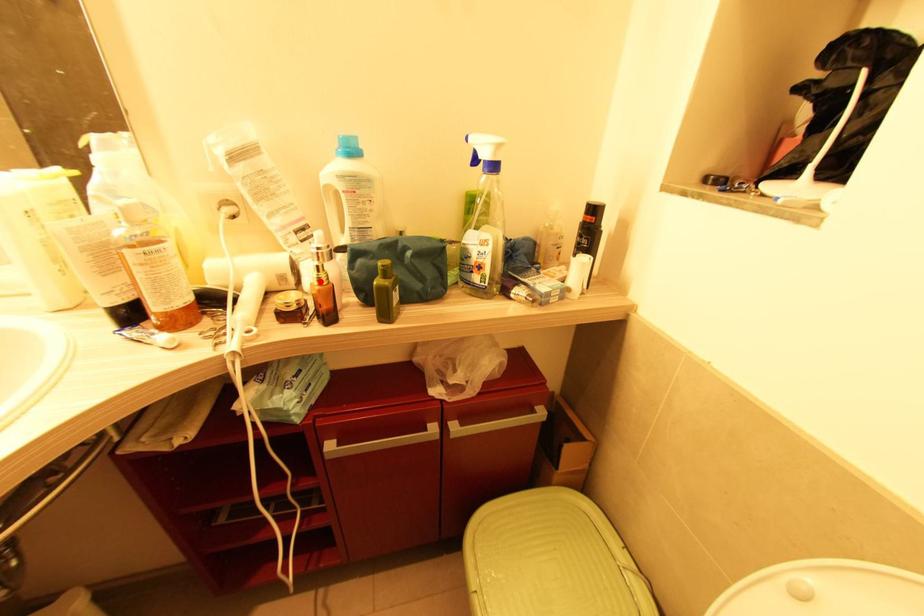
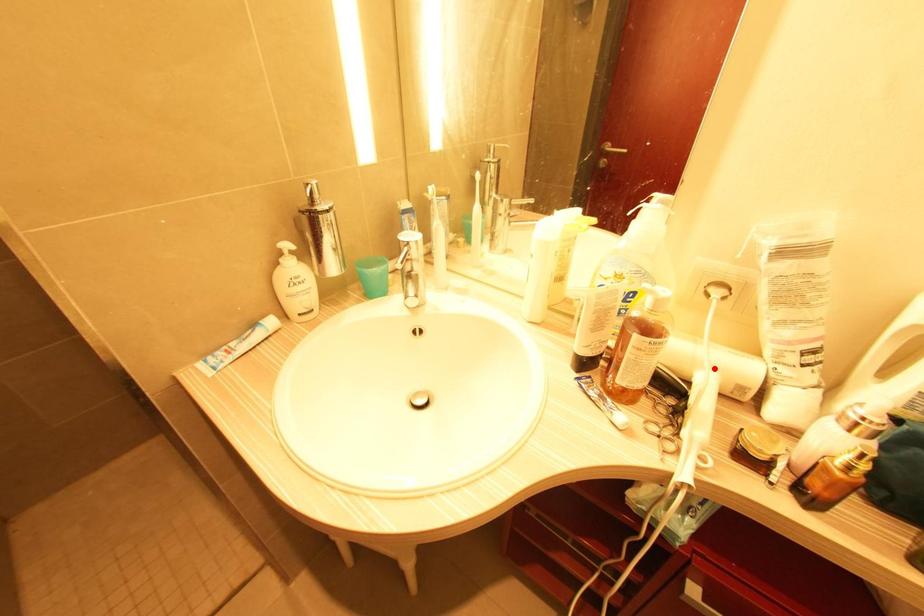
I am providing you with two images of the same scene from different viewpoints. A red point is marked on the first image and another point is marked on the second image. Does the point marked in image1 correspond to the same location as the one in image2?

No